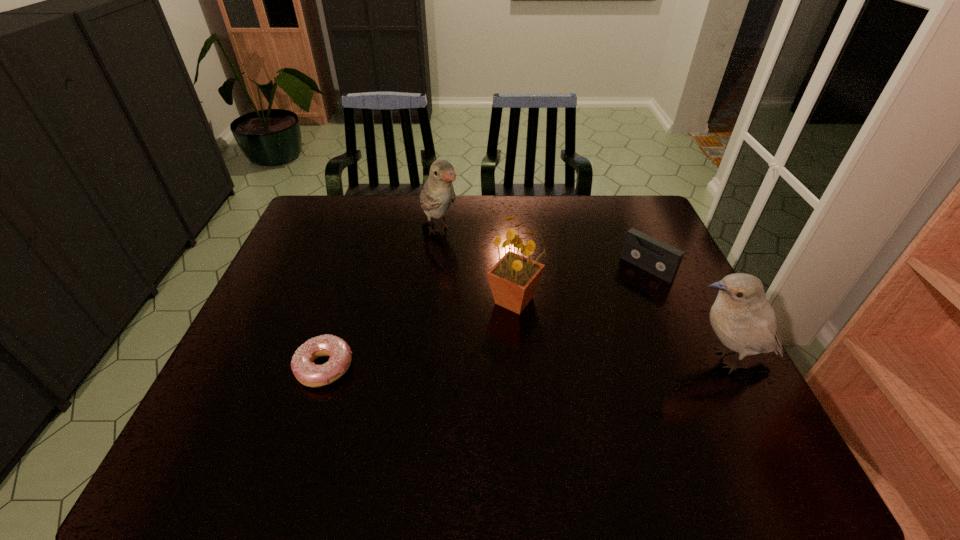
This screenshot has width=960, height=540. Find the location of `free spot on the desktop that is between the leftmost object and the nearer bird and is positioned on the front-facing side of the second shortest object`. free spot on the desktop that is between the leftmost object and the nearer bird and is positioned on the front-facing side of the second shortest object is located at coordinates (542, 363).

Where is `free spot on the desktop that is between the shortest object and the right bird and is positioned at the front of the third object from right to left with flowers visible`? free spot on the desktop that is between the shortest object and the right bird and is positioned at the front of the third object from right to left with flowers visible is located at coordinates (538, 363).

Where is `free space on the desktop that is between the shortest object and the right bird and is positioned at the face of the left bird`? This screenshot has height=540, width=960. free space on the desktop that is between the shortest object and the right bird and is positioned at the face of the left bird is located at coordinates (561, 363).